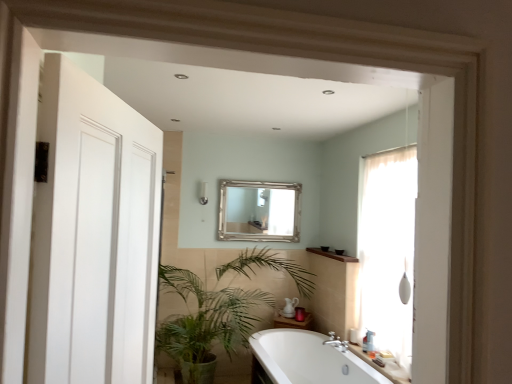
The width and height of the screenshot is (512, 384). In order to click on free space below silver metallic mirror at upper center (from a real-world perspective) in this screenshot , I will do `click(251, 247)`.